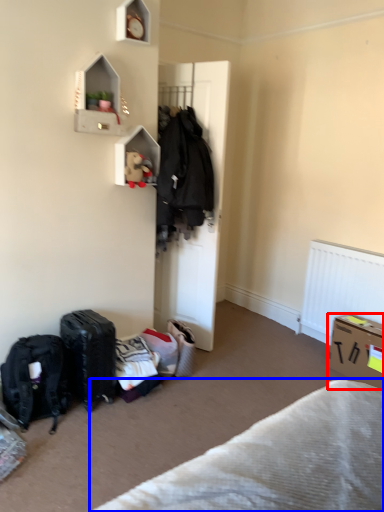
Question: Which object appears closest to the camera in this image, box (highlighted by a red box) or furniture (highlighted by a blue box)?

Choices:
 (A) box
 (B) furniture

Answer: (B)